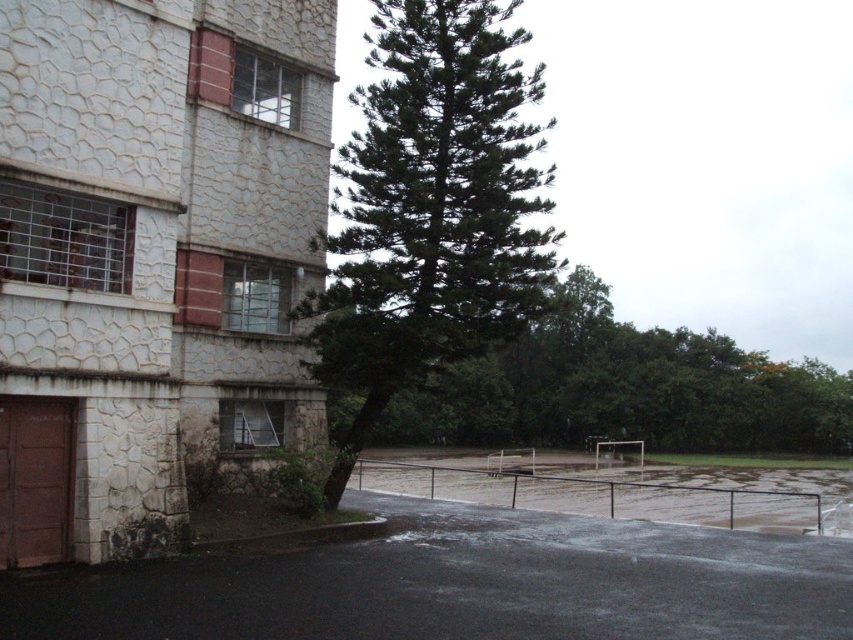
Can you confirm if dark green leafy tree at center is positioned above green leafy tree at center?

Yes.

Describe the element at coordinates (431, 211) in the screenshot. The width and height of the screenshot is (853, 640). I see `dark green leafy tree at center` at that location.

Identify the location of dark green leafy tree at center. (431, 211).